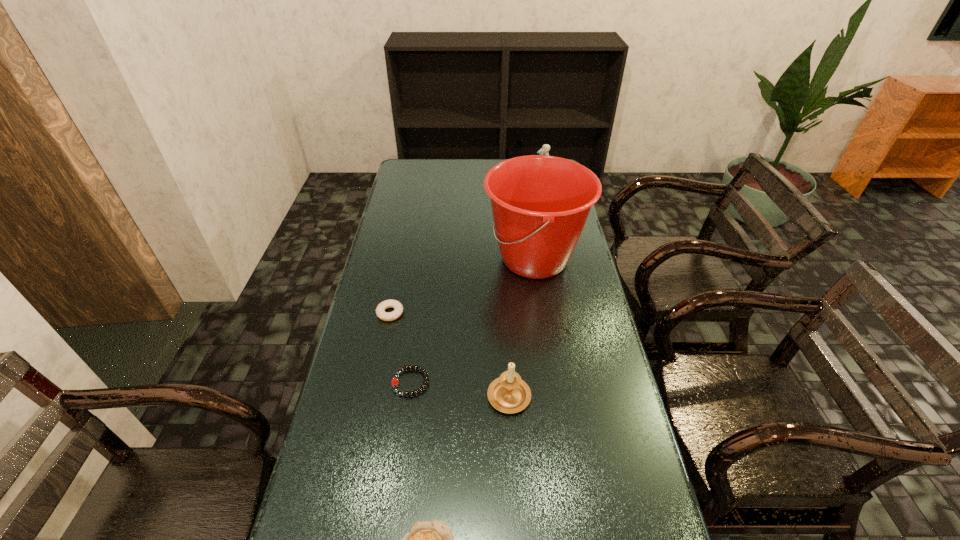
Find the location of a particular element. The width and height of the screenshot is (960, 540). vacant point located with the handle attached to the rim of the tallest object is located at coordinates (447, 259).

Identify the location of vacant region located at the beak of the fifth shortest object. The image size is (960, 540). (471, 187).

You are a GUI agent. You are given a task and a screenshot of the screen. Output one action in this format:
    pyautogui.click(x=<x>, y=<y>)
    Task: Click on the free space located 0.240m at the beak of the fifth shortest object
    
    Given the screenshot: What is the action you would take?
    pyautogui.click(x=476, y=187)

Find the location of `free location located at the beak of the fifth shortest object`. free location located at the beak of the fifth shortest object is located at coordinates (518, 187).

Where is `free space located with a handle on the side of the candle holder`? The image size is (960, 540). free space located with a handle on the side of the candle holder is located at coordinates (504, 303).

The image size is (960, 540). I want to click on vacant space located 0.220m with a handle on the side of the candle holder, so click(504, 314).

The height and width of the screenshot is (540, 960). What are the coordinates of `free location located 0.110m with a handle on the side of the candle holder` in the screenshot? It's located at (506, 342).

You are a GUI agent. You are given a task and a screenshot of the screen. Output one action in this format:
    pyautogui.click(x=<x>, y=<y>)
    Task: Click on the vacant position located 0.200m on the right of the leftmost object
    The image size is (960, 540).
    Given the screenshot: What is the action you would take?
    pyautogui.click(x=467, y=313)

This screenshot has height=540, width=960. I want to click on blank space located 0.390m on the right of the bracelet, so click(x=573, y=382).

The width and height of the screenshot is (960, 540). Find the location of `object located in the far edge section of the desktop`. object located in the far edge section of the desktop is located at coordinates (544, 150).